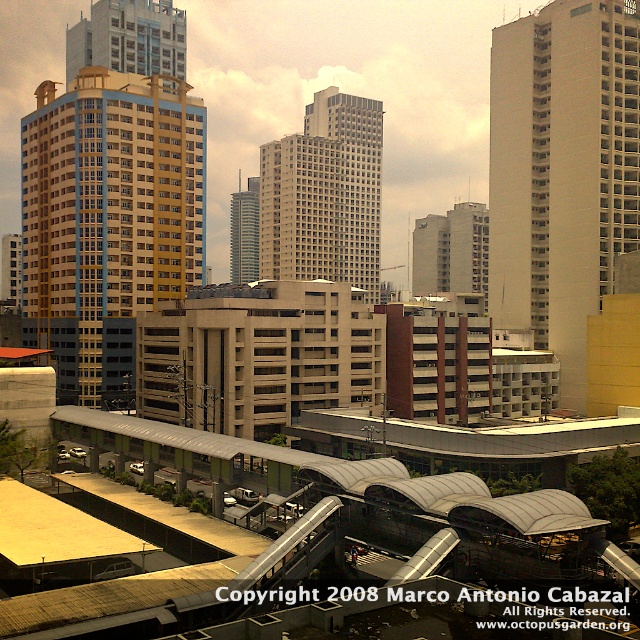
Question: Among these objects, which one is farthest from the camera?

Choices:
 (A) white concrete building at center
 (B) matte glass skyscraper at upper left
 (C) smooth glass skyscraper at center
 (D) white glass building at center

Answer: (C)

Question: Estimate the real-world distances between objects in this image. Which object is closer to the smooth glass skyscraper at center?

Choices:
 (A) matte glass skyscraper at upper left
 (B) white concrete building at center
 (C) yellow matte building at center

Answer: (A)

Question: Which object appears farthest from the camera in this image?

Choices:
 (A) white concrete building at center
 (B) white glass building at center

Answer: (B)

Question: Is the position of white concrete building at center more distant than that of matte glass skyscraper at upper left?

Choices:
 (A) no
 (B) yes

Answer: (A)

Question: Is white glass building at center to the left of smooth glass skyscraper at center from the viewer's perspective?

Choices:
 (A) yes
 (B) no

Answer: (B)

Question: Does white concrete building at center appear over yellow matte building at center?

Choices:
 (A) yes
 (B) no

Answer: (B)